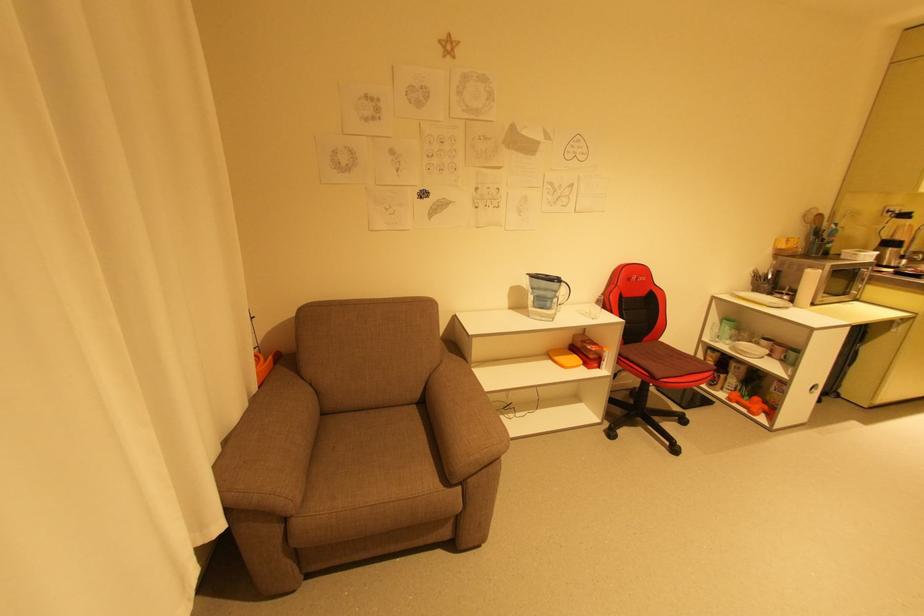
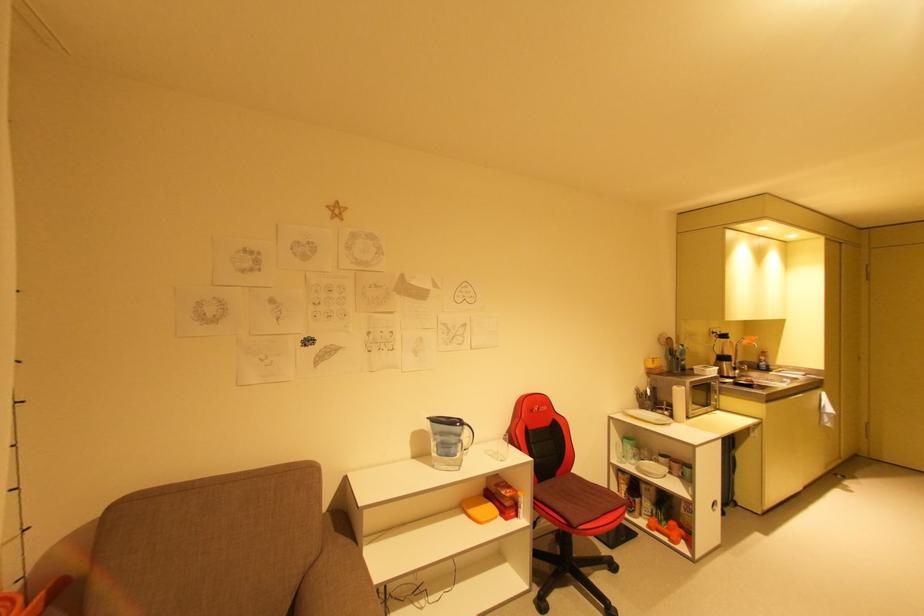
Find the pixel in the second image that matches (x=844, y=292) in the first image.

(708, 403)